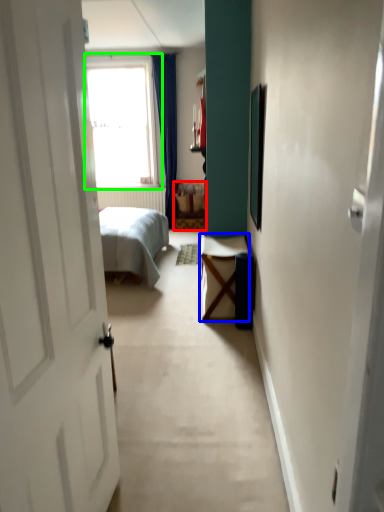
Question: Estimate the real-world distances between objects in this image. Which object is closer to furniture (highlighted by a red box), table (highlighted by a blue box) or window (highlighted by a green box)?

Choices:
 (A) table
 (B) window

Answer: (B)